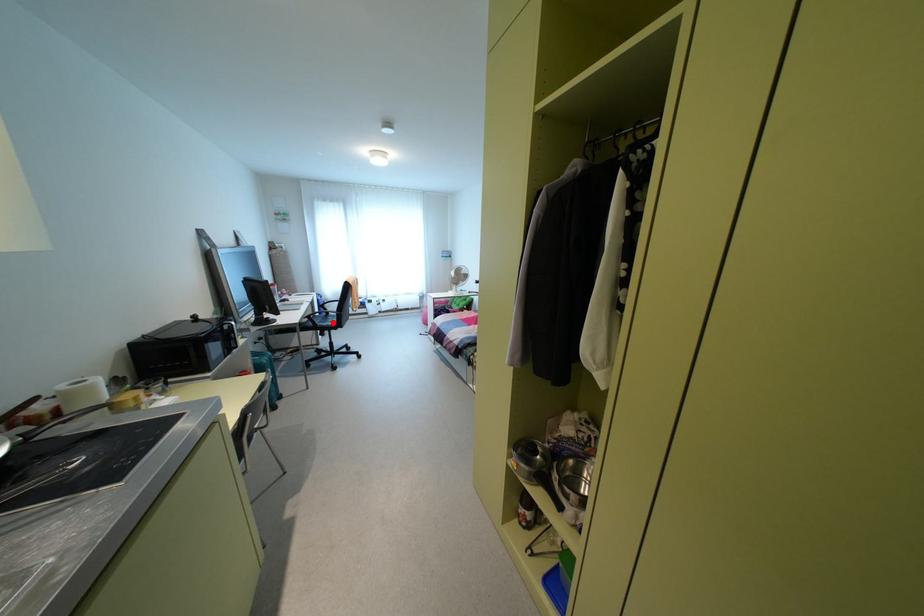
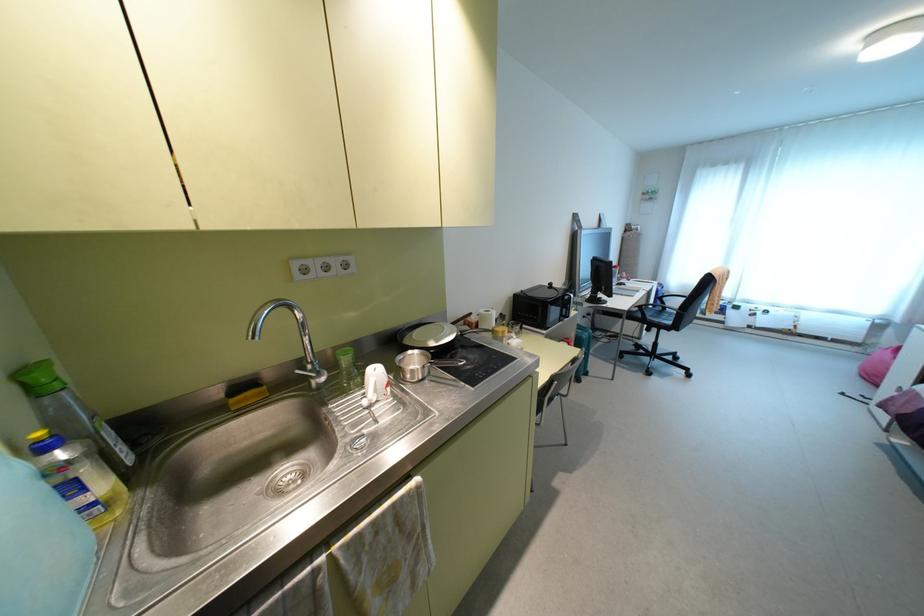
In the second image, find the point that corresponds to the highlighted location in the first image.

(667, 322)